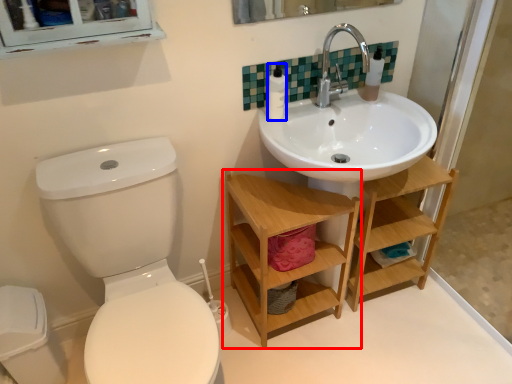
Question: Among these objects, which one is nearest to the camera, shelf (highlighted by a red box) or toiletry (highlighted by a blue box)?

Choices:
 (A) shelf
 (B) toiletry

Answer: (A)